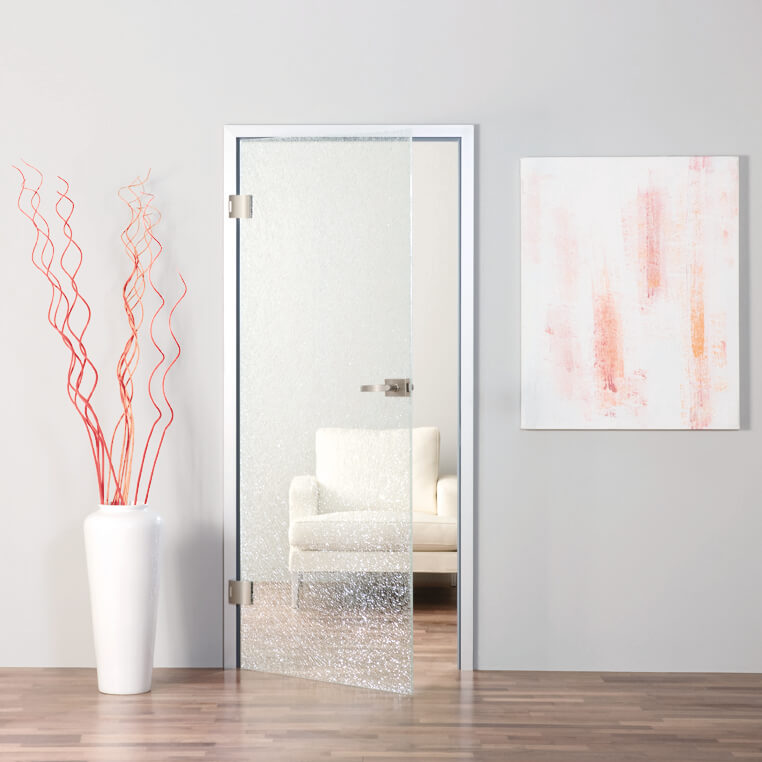
The height and width of the screenshot is (762, 762). I want to click on chair leg, so click(289, 584).